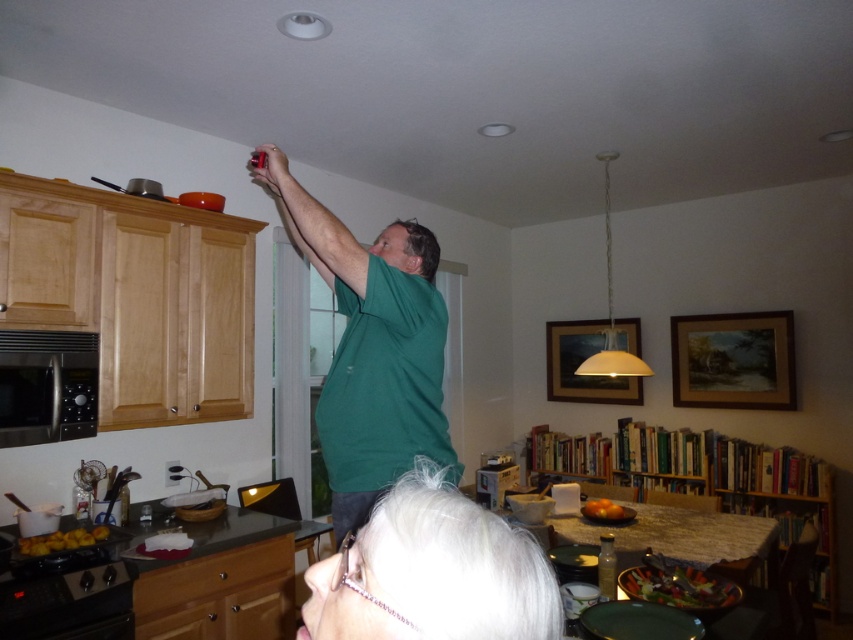
Question: Which point is farther to the camera?

Choices:
 (A) green matte shirt at upper center
 (B) white hair at lower center
 (C) stainless steel microwave at left

Answer: (C)

Question: Observing the image, what is the correct spatial positioning of white hair at lower center in reference to stainless steel microwave at left?

Choices:
 (A) right
 (B) left

Answer: (A)

Question: Is green matte shirt at upper center wider than stainless steel microwave at left?

Choices:
 (A) no
 (B) yes

Answer: (B)

Question: In this image, where is white hair at lower center located relative to stainless steel microwave at left?

Choices:
 (A) left
 (B) right

Answer: (B)

Question: Which object appears farthest from the camera in this image?

Choices:
 (A) white hair at lower center
 (B) stainless steel microwave at left
 (C) green matte shirt at upper center

Answer: (B)

Question: Which point is farther to the camera?

Choices:
 (A) (426, 227)
 (B) (91, 365)
 (C) (314, 605)

Answer: (A)